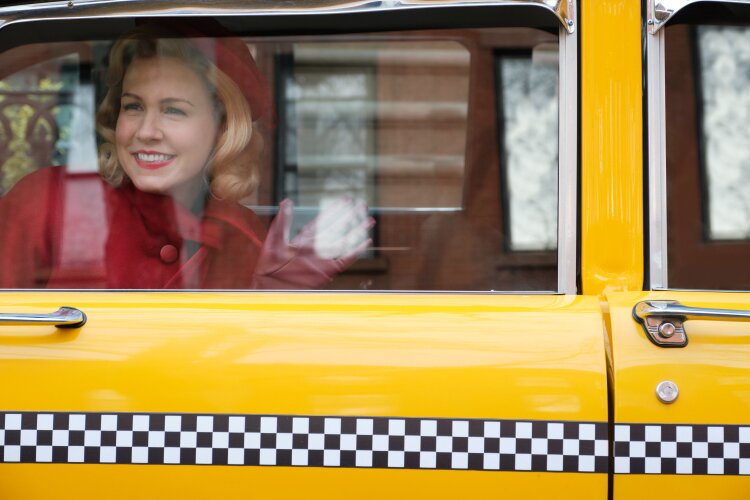
Where is `stairs`? The image size is (750, 500). stairs is located at coordinates (424, 123).